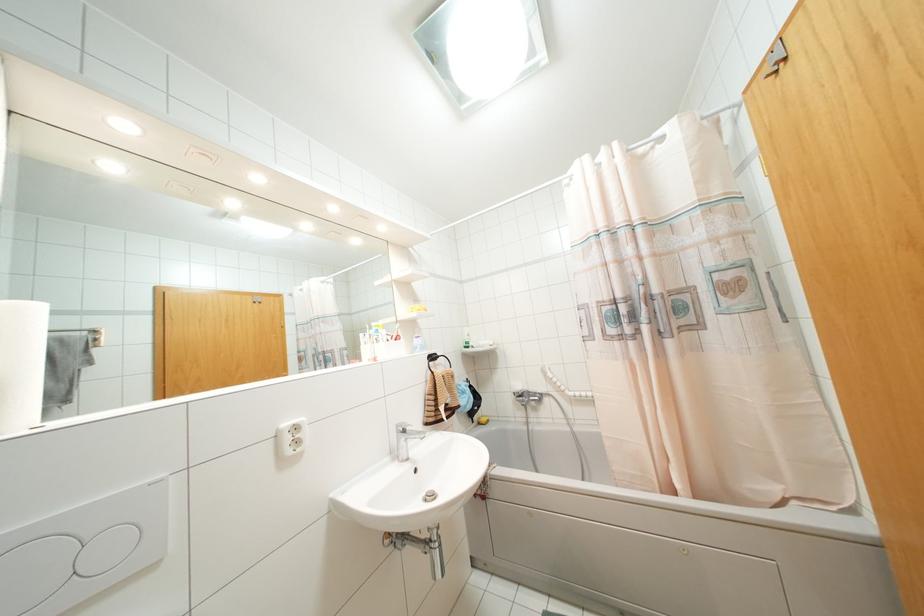
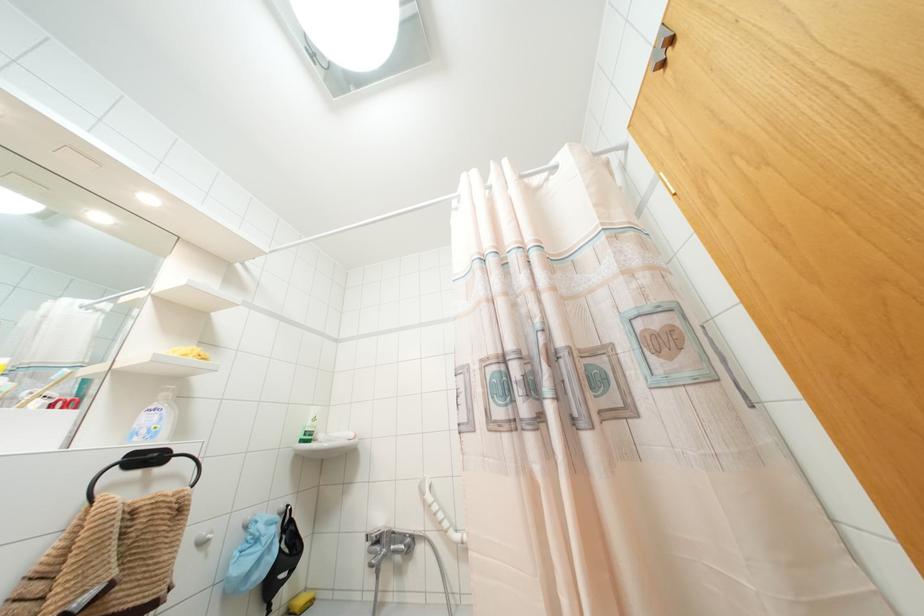
Locate, in the second image, the point that corresponds to the point at 432,357 in the first image.

(147, 458)